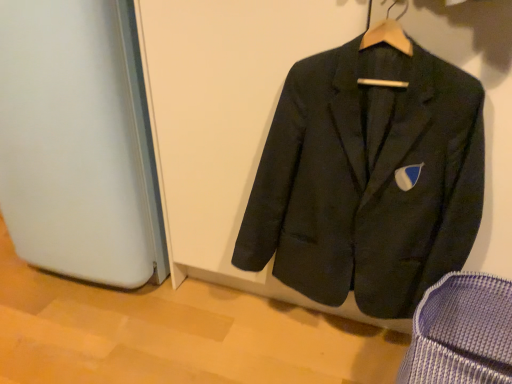
Question: Would you say matte black suit at center is to the left or to the right of textured blue fabric armchair at lower right in the picture?

Choices:
 (A) left
 (B) right

Answer: (A)

Question: Considering the positions of matte black suit at center and textured blue fabric armchair at lower right in the image, is matte black suit at center bigger or smaller than textured blue fabric armchair at lower right?

Choices:
 (A) small
 (B) big

Answer: (B)

Question: From a real-world perspective, is matte black suit at center physically located above or below textured blue fabric armchair at lower right?

Choices:
 (A) above
 (B) below

Answer: (A)

Question: Considering the positions of textured blue fabric armchair at lower right and matte black suit at center in the image, is textured blue fabric armchair at lower right wider or thinner than matte black suit at center?

Choices:
 (A) thin
 (B) wide

Answer: (B)

Question: In the image, is textured blue fabric armchair at lower right positioned in front of or behind matte black suit at center?

Choices:
 (A) front
 (B) behind

Answer: (A)

Question: Is textured blue fabric armchair at lower right inside the boundaries of matte black suit at center, or outside?

Choices:
 (A) inside
 (B) outside

Answer: (B)

Question: From their relative heights in the image, would you say textured blue fabric armchair at lower right is taller or shorter than matte black suit at center?

Choices:
 (A) tall
 (B) short

Answer: (B)